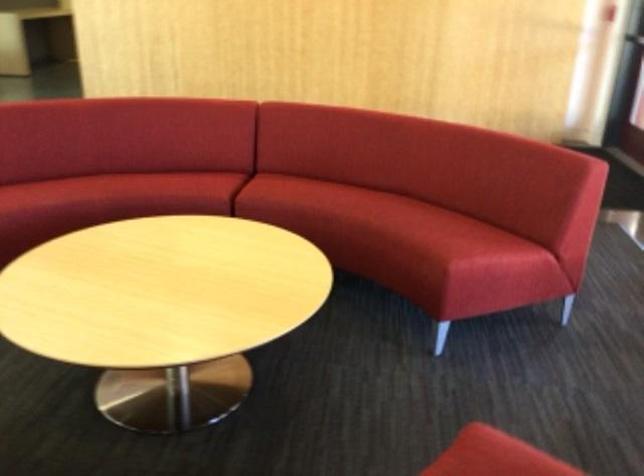
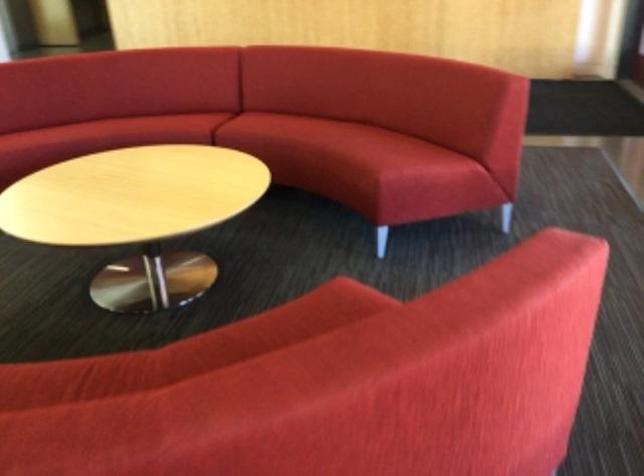
Find the pixel in the second image that matches point 366,208 in the first image.

(326, 134)